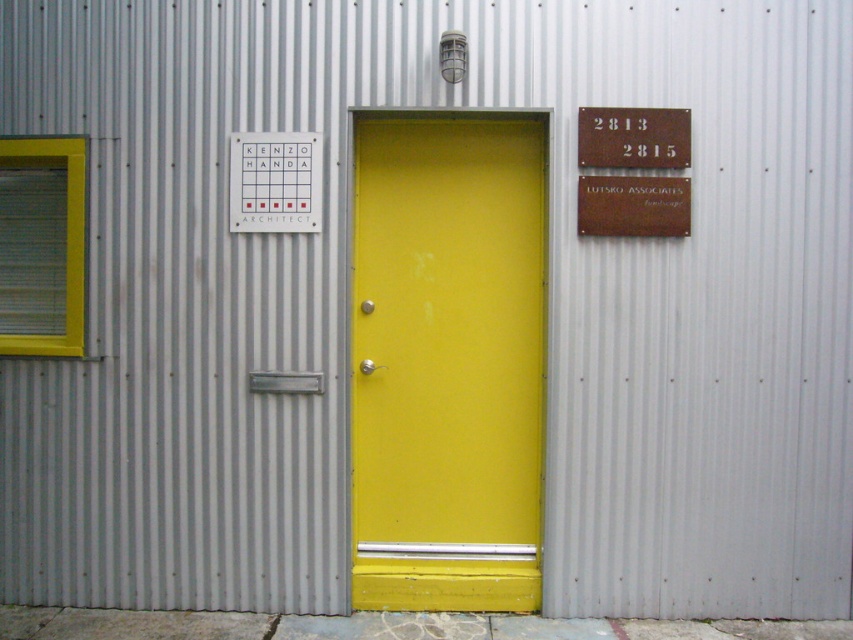
Between matte white sign at center and bronze plaque at upper right, which one has more height?

matte white sign at center is taller.

Is point (245, 134) farther from camera compared to point (616, 204)?

That is True.

Is point (256, 170) positioned in front of point (616, 220)?

No, it is behind (616, 220).

Image resolution: width=853 pixels, height=640 pixels. What are the coordinates of `matte white sign at center` in the screenshot? It's located at (276, 182).

Can you confirm if yellow matte door at center is positioned to the right of bronze plaque at upper right?

No, yellow matte door at center is not to the right of bronze plaque at upper right.

Between point (392, 280) and point (664, 212), which one is positioned behind?

Point (392, 280)

Find the location of a particular element. This screenshot has height=640, width=853. yellow matte door at center is located at coordinates [x=447, y=362].

Does rusty metal sign at upper right appear on the left side of bronze plaque at upper right?

Indeed, rusty metal sign at upper right is positioned on the left side of bronze plaque at upper right.

Does rusty metal sign at upper right have a lesser height compared to bronze plaque at upper right?

In fact, rusty metal sign at upper right may be taller than bronze plaque at upper right.

Find the location of a particular element. rusty metal sign at upper right is located at coordinates (633, 138).